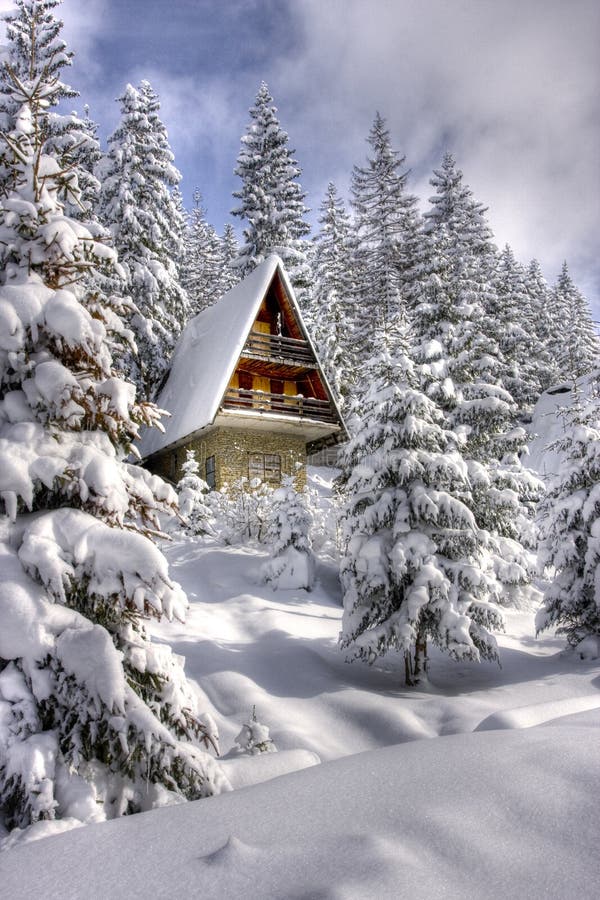
Locate an element on the screen. This screenshot has width=600, height=900. window is located at coordinates (264, 469), (210, 478).